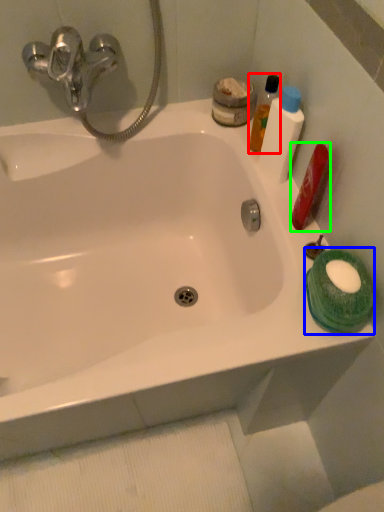
Question: Estimate the real-world distances between objects in this image. Which object is farther from mouthwash (highlighted by a red box), mouthwash (highlighted by a blue box) or mouthwash (highlighted by a green box)?

Choices:
 (A) mouthwash
 (B) mouthwash

Answer: (A)